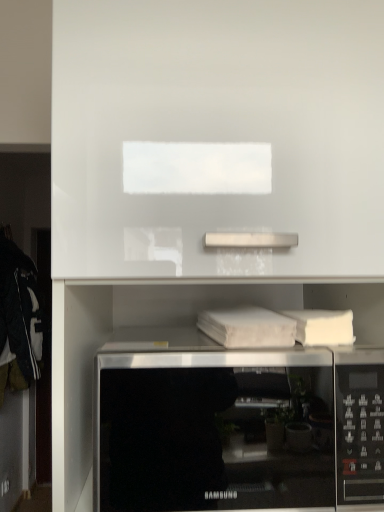
You are a GUI agent. You are given a task and a screenshot of the screen. Output one action in this format:
    pyautogui.click(x=<x>, y=<y>)
    Task: Click on the free region on the left part of white matte book at center
    Image resolution: width=384 pixels, height=512 pixels.
    Given the screenshot: What is the action you would take?
    pyautogui.click(x=168, y=336)